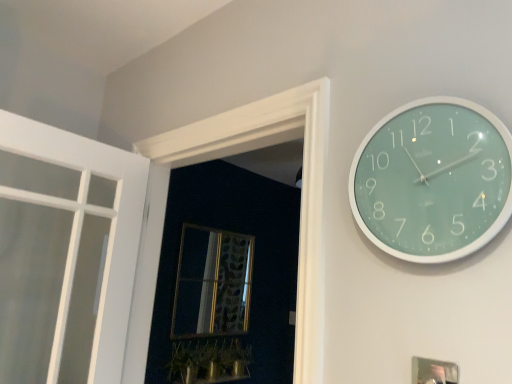
At what (x,y) coordinates should I click in order to perform the action: click on teal glossy clock at upper right. Please return your answer as a coordinate pair (x, y). Looking at the image, I should click on (433, 180).

Where is `white wood frame at upper left`? The image size is (512, 384). white wood frame at upper left is located at coordinates (302, 186).

The height and width of the screenshot is (384, 512). What are the coordinates of `gold-framed mirror at center` in the screenshot? It's located at (212, 283).

Between teal glossy clock at upper right and metallic silver picture frame at lower right, which one appears on the right side from the viewer's perspective?

From the viewer's perspective, teal glossy clock at upper right appears more on the right side.

Does teal glossy clock at upper right have a greater height compared to metallic silver picture frame at lower right?

Yes, teal glossy clock at upper right is taller than metallic silver picture frame at lower right.

Identify the location of picture frame below the teal glossy clock at upper right (from the image's perspective). The image size is (512, 384). click(434, 371).

From a real-world perspective, between teal glossy clock at upper right and metallic silver picture frame at lower right, who is vertically higher?

From a 3D spatial view, teal glossy clock at upper right is above.

Can we say white wood frame at upper left lies outside green glossy plant at lower center?

white wood frame at upper left lies outside green glossy plant at lower center's area.

Considering the sizes of white wood frame at upper left and green glossy plant at lower center in the image, is white wood frame at upper left wider or thinner than green glossy plant at lower center?

In the image, white wood frame at upper left appears to be wider than green glossy plant at lower center.

Which of these two, white wood frame at upper left or green glossy plant at lower center, stands taller?

Standing taller between the two is white wood frame at upper left.

Would you say green glossy plant at lower center is outside white wood frame at upper left?

Absolutely, green glossy plant at lower center is external to white wood frame at upper left.

Is green glossy plant at lower center touching white wood frame at upper left?

No.

What's the angular difference between metallic silver picture frame at lower right and green glossy plant at lower center's facing directions?

There is a 93.5-degree angle between the facing directions of metallic silver picture frame at lower right and green glossy plant at lower center.

Based on their positions, is metallic silver picture frame at lower right located to the left or right of green glossy plant at lower center?

Based on their positions, metallic silver picture frame at lower right is located to the right of green glossy plant at lower center.

Where is `picture frame positioned vertically above the green glossy plant at lower center (from a real-world perspective)`? picture frame positioned vertically above the green glossy plant at lower center (from a real-world perspective) is located at coordinates (434, 371).

Considering the sizes of objects green glossy plant at lower center and gold-framed mirror at center in the image provided, who is wider, green glossy plant at lower center or gold-framed mirror at center?

green glossy plant at lower center is wider.

Which point is more forward, (249, 351) or (204, 333)?

The point (204, 333) is in front.

Is green glossy plant at lower center to the left of gold-framed mirror at center from the viewer's perspective?

Indeed, green glossy plant at lower center is positioned on the left side of gold-framed mirror at center.

Is green glossy plant at lower center in front of or behind gold-framed mirror at center in the image?

Clearly, green glossy plant at lower center is in front of gold-framed mirror at center.

Is metallic silver picture frame at lower right behind gold-framed mirror at center?

No, metallic silver picture frame at lower right is in front of gold-framed mirror at center.

Identify the location of window behind the metallic silver picture frame at lower right. (212, 283).

Is metallic silver picture frame at lower right at the left side of gold-framed mirror at center?

In fact, metallic silver picture frame at lower right is to the right of gold-framed mirror at center.

Is metallic silver picture frame at lower right not inside gold-framed mirror at center?

metallic silver picture frame at lower right lies outside gold-framed mirror at center's area.

Is teal glossy clock at upper right to the right of green glossy plant at lower center from the viewer's perspective?

Indeed, teal glossy clock at upper right is positioned on the right side of green glossy plant at lower center.

Can you confirm if teal glossy clock at upper right is wider than green glossy plant at lower center?

Incorrect, the width of teal glossy clock at upper right does not surpass that of green glossy plant at lower center.

Is teal glossy clock at upper right oriented away from green glossy plant at lower center?

No.

Is teal glossy clock at upper right in front of or behind green glossy plant at lower center in the image?

Visually, teal glossy clock at upper right is located in front of green glossy plant at lower center.

In the image, there is a teal glossy clock at upper right. Identify the location of picture frame below it (from a real-world perspective). (434, 371).

The height and width of the screenshot is (384, 512). In the image, there is a white wood frame at upper left. What are the coordinates of `plant below it (from the image's perspective)` in the screenshot? It's located at (208, 361).

Looking at the image, which one is located further to teal glossy clock at upper right, green glossy plant at lower center or metallic silver picture frame at lower right?

green glossy plant at lower center is further to teal glossy clock at upper right.

When comparing their distances from gold-framed mirror at center, does teal glossy clock at upper right or green glossy plant at lower center seem further?

Among the two, teal glossy clock at upper right is located further to gold-framed mirror at center.

Which object lies further to the anchor point green glossy plant at lower center, metallic silver picture frame at lower right or teal glossy clock at upper right?

teal glossy clock at upper right is further to green glossy plant at lower center.

Looking at the image, which one is located closer to gold-framed mirror at center, green glossy plant at lower center or metallic silver picture frame at lower right?

green glossy plant at lower center is closer to gold-framed mirror at center.

Based on their spatial positions, is gold-framed mirror at center or green glossy plant at lower center further from white wood frame at upper left?

The object further to white wood frame at upper left is gold-framed mirror at center.

Based on their spatial positions, is green glossy plant at lower center or white wood frame at upper left closer to gold-framed mirror at center?

green glossy plant at lower center is closer to gold-framed mirror at center.

Considering their positions, is gold-framed mirror at center positioned further to green glossy plant at lower center than teal glossy clock at upper right?

teal glossy clock at upper right lies further to green glossy plant at lower center than the other object.

Looking at the image, which one is located closer to gold-framed mirror at center, metallic silver picture frame at lower right or teal glossy clock at upper right?

teal glossy clock at upper right is closer to gold-framed mirror at center.

Where is `plant between white wood frame at upper left and gold-framed mirror at center along the z-axis`? The image size is (512, 384). plant between white wood frame at upper left and gold-framed mirror at center along the z-axis is located at coordinates (208, 361).

Where is `picture frame positioned between teal glossy clock at upper right and gold-framed mirror at center from near to far`? picture frame positioned between teal glossy clock at upper right and gold-framed mirror at center from near to far is located at coordinates (434, 371).

In order to click on window frame positioned between metallic silver picture frame at lower right and green glossy plant at lower center from near to far in this screenshot , I will do `click(302, 186)`.

In order to click on window frame between teal glossy clock at upper right and gold-framed mirror at center along the z-axis in this screenshot , I will do `click(302, 186)`.